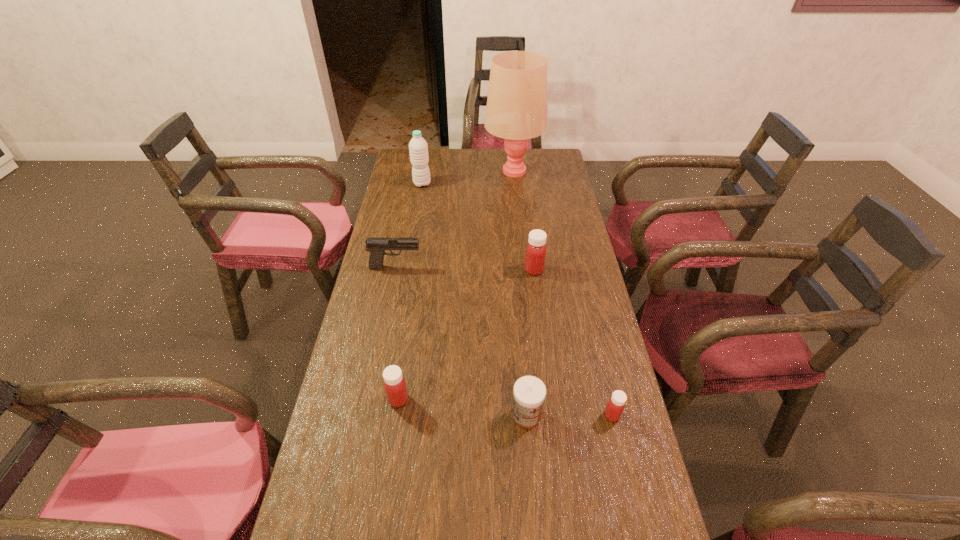
Point out which medicine is positioned as the third nearest to the leftmost red medicine. Please provide its 2D coordinates. Your answer should be formatted as a tuple, i.e. [(x, y)], where the tuple contains the x and y coordinates of a point satisfying the conditions above.

[(535, 255)]

Where is `red medicine that is the closest to the pink lampshade`? red medicine that is the closest to the pink lampshade is located at coordinates (535, 255).

Identify which red medicine is the closest to the shortest medicine. Please provide its 2D coordinates. Your answer should be formatted as a tuple, i.e. [(x, y)], where the tuple contains the x and y coordinates of a point satisfying the conditions above.

[(535, 255)]

At what (x,y) coordinates should I click in order to perform the action: click on vacant space that satisfies the following two spatial constraints: 1. on the back side of the second biggest red medicine; 2. aim along the barrel of the pistol. Please return your answer as a coordinate pair (x, y). The image size is (960, 540). Looking at the image, I should click on (419, 267).

Where is `free location that satisfies the following two spatial constraints: 1. aim along the barrel of the white medicine; 2. on the right side of the pistol`? The height and width of the screenshot is (540, 960). free location that satisfies the following two spatial constraints: 1. aim along the barrel of the white medicine; 2. on the right side of the pistol is located at coordinates (366, 416).